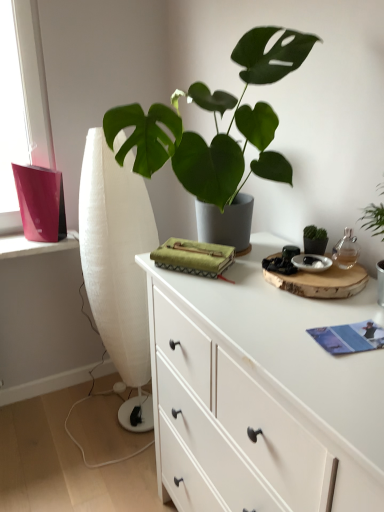
Locate an element on the screen. The width and height of the screenshot is (384, 512). free space in front of white fabric curtain at left is located at coordinates (110, 463).